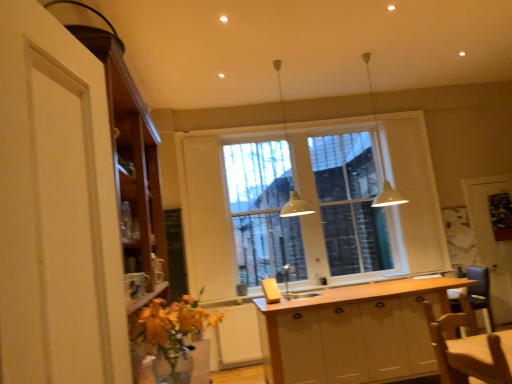
Question: Does wooden screen door at right, the second screen door when ordered from front to back, have a greater height compared to wooden cabinet at left, the second cabinetry when ordered from bottom to top?

Choices:
 (A) yes
 (B) no

Answer: (A)

Question: Is wooden screen door at right, which appears as the 2th screen door when viewed from the left, oriented towards wooden cabinet at left, which ranks as the 2th cabinetry in right-to-left order?

Choices:
 (A) yes
 (B) no

Answer: (B)

Question: Does wooden screen door at right, which appears as the 2th screen door when viewed from the left, lie behind wooden cabinet at left, the first cabinetry positioned from the left?

Choices:
 (A) yes
 (B) no

Answer: (A)

Question: From a real-world perspective, is wooden screen door at right, the 1th screen door when ordered from right to left, located higher than wooden cabinet at left, the second cabinetry in the back-to-front sequence?

Choices:
 (A) no
 (B) yes

Answer: (A)

Question: Is point (479, 198) closer or farther from the camera than point (446, 279)?

Choices:
 (A) farther
 (B) closer

Answer: (A)

Question: Is wooden screen door at right, acting as the 1th screen door starting from the back, taller or shorter than light wood countertop at center?

Choices:
 (A) tall
 (B) short

Answer: (A)

Question: Is wooden screen door at right, the second screen door when ordered from front to back, bigger or smaller than light wood countertop at center?

Choices:
 (A) small
 (B) big

Answer: (B)

Question: From the image's perspective, relative to light wood countertop at center, is wooden screen door at right, the second screen door when ordered from front to back, above or below?

Choices:
 (A) below
 (B) above

Answer: (B)

Question: Is wooden cabinet at left, the second cabinetry in the back-to-front sequence, wider or thinner than wooden screen door at right, the 1th screen door when ordered from right to left?

Choices:
 (A) thin
 (B) wide

Answer: (B)

Question: From their relative heights in the image, would you say wooden cabinet at left, which is the 1th cabinetry from front to back, is taller or shorter than wooden screen door at right, acting as the 1th screen door starting from the back?

Choices:
 (A) short
 (B) tall

Answer: (A)

Question: From the image's perspective, is wooden cabinet at left, which is the 1th cabinetry from front to back, located above or below wooden screen door at right, acting as the 1th screen door starting from the back?

Choices:
 (A) above
 (B) below

Answer: (A)

Question: Looking at the image, does wooden cabinet at left, the first cabinetry positioned from the left, seem bigger or smaller compared to wooden screen door at right, the second screen door when ordered from front to back?

Choices:
 (A) small
 (B) big

Answer: (B)

Question: In the image, is white wood cabinet at center, marked as the second cabinetry in a top-to-bottom arrangement, positioned in front of or behind wooden screen door at right, acting as the 1th screen door starting from the back?

Choices:
 (A) front
 (B) behind

Answer: (A)

Question: Considering the positions of point (415, 342) and point (495, 299), is point (415, 342) closer or farther from the camera than point (495, 299)?

Choices:
 (A) farther
 (B) closer

Answer: (B)